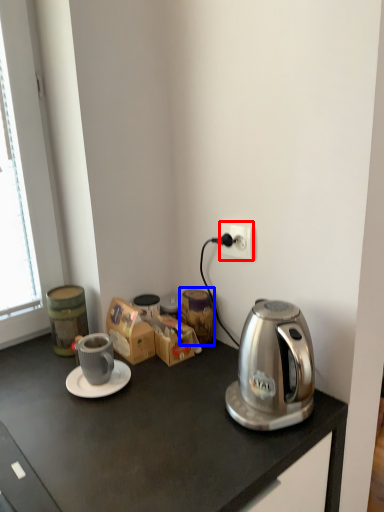
Question: Which point is closer to the camera, power outlet (highlighted by a red box) or appliance (highlighted by a blue box)?

Choices:
 (A) power outlet
 (B) appliance

Answer: (A)